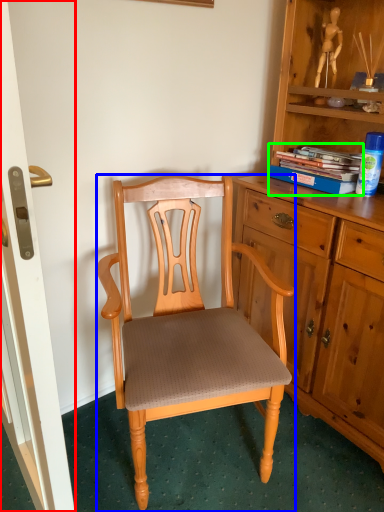
Question: Which object is positioned closest to screen door (highlighted by a red box)? Select from chair (highlighted by a blue box) and book (highlighted by a green box).

Choices:
 (A) chair
 (B) book

Answer: (A)